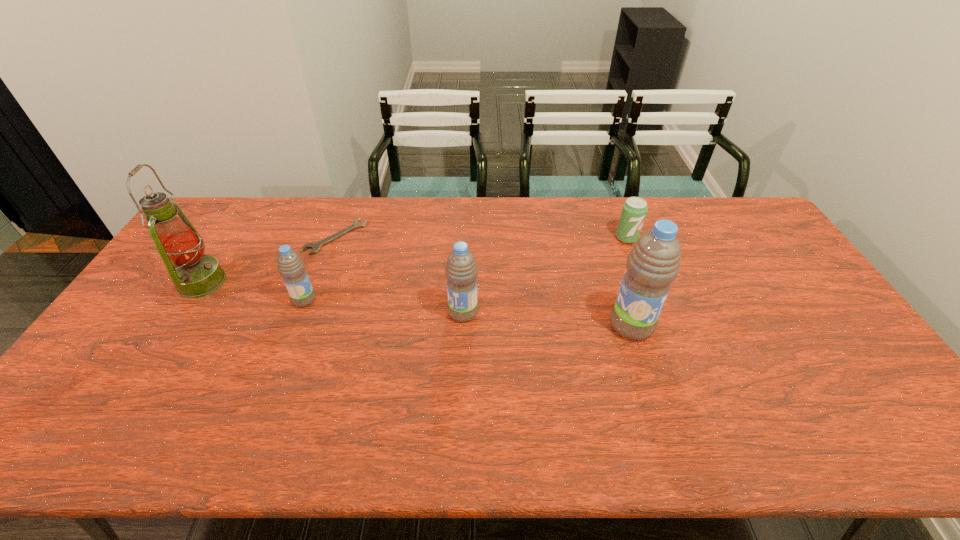
Where is `vacant space situated on the right of the tallest water bottle`? The width and height of the screenshot is (960, 540). vacant space situated on the right of the tallest water bottle is located at coordinates (711, 326).

Where is `vacant point located on the front of the fifth tallest object`? Image resolution: width=960 pixels, height=540 pixels. vacant point located on the front of the fifth tallest object is located at coordinates (634, 257).

Identify the location of vacant space located 0.130m on the right of the shortest object. The image size is (960, 540). (401, 237).

Where is `free region located 0.280m on the back of the oil lamp`? This screenshot has height=540, width=960. free region located 0.280m on the back of the oil lamp is located at coordinates (248, 211).

What are the coordinates of `soda that is at the far edge` in the screenshot? It's located at (634, 210).

Locate an element on the screen. wrench located in the far edge section of the desktop is located at coordinates (315, 246).

At what (x,y) coordinates should I click in order to perform the action: click on object that is at the left edge. Please return your answer as a coordinate pair (x, y). This screenshot has width=960, height=540. Looking at the image, I should click on (195, 275).

Where is `blank space at the far edge of the desktop`? This screenshot has width=960, height=540. blank space at the far edge of the desktop is located at coordinates (428, 222).

Find the location of a particular element. vacant space at the near edge of the desktop is located at coordinates (659, 384).

The width and height of the screenshot is (960, 540). Identify the location of vacant space at the far left corner of the desktop. 226,206.